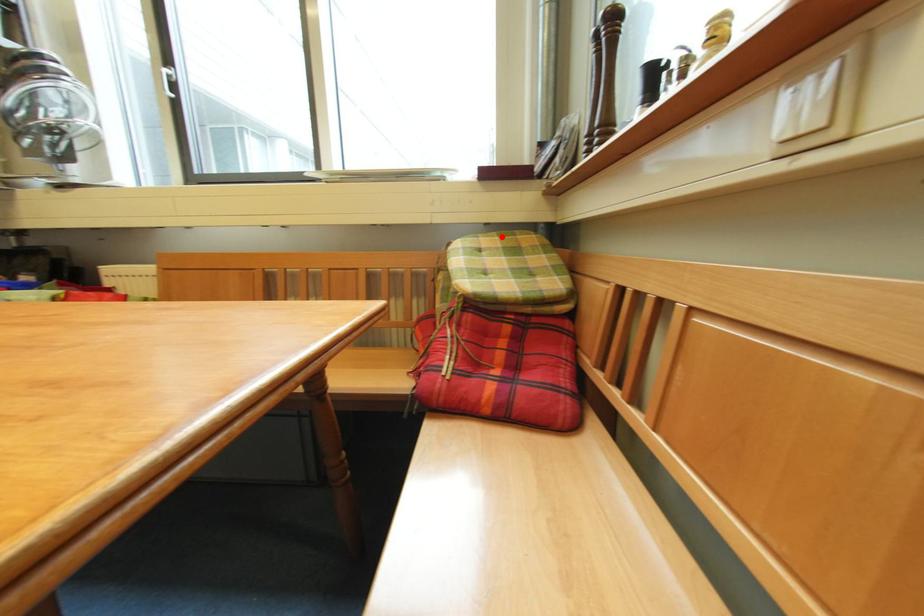
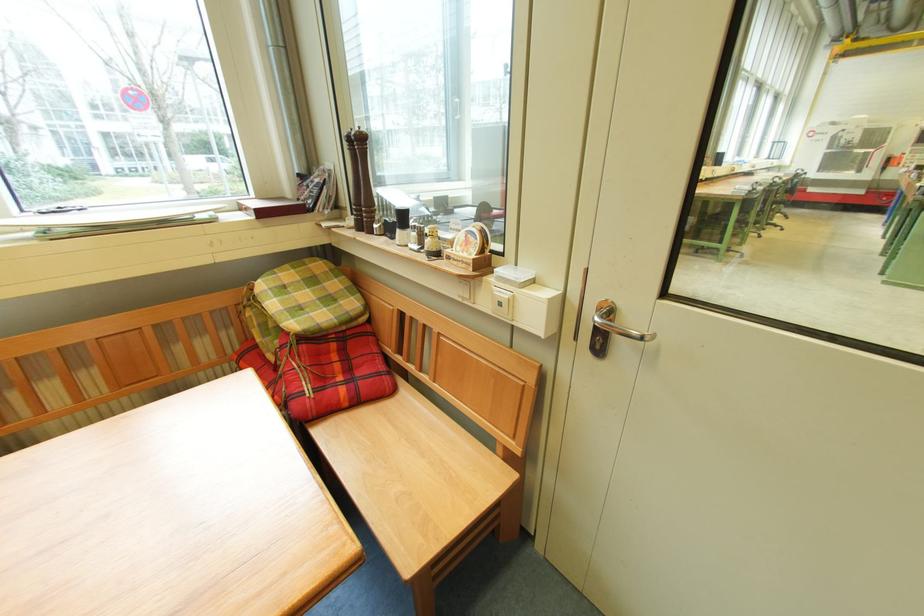
The point at the highlighted location is marked in the first image. Where is the corresponding point in the second image?

(295, 268)